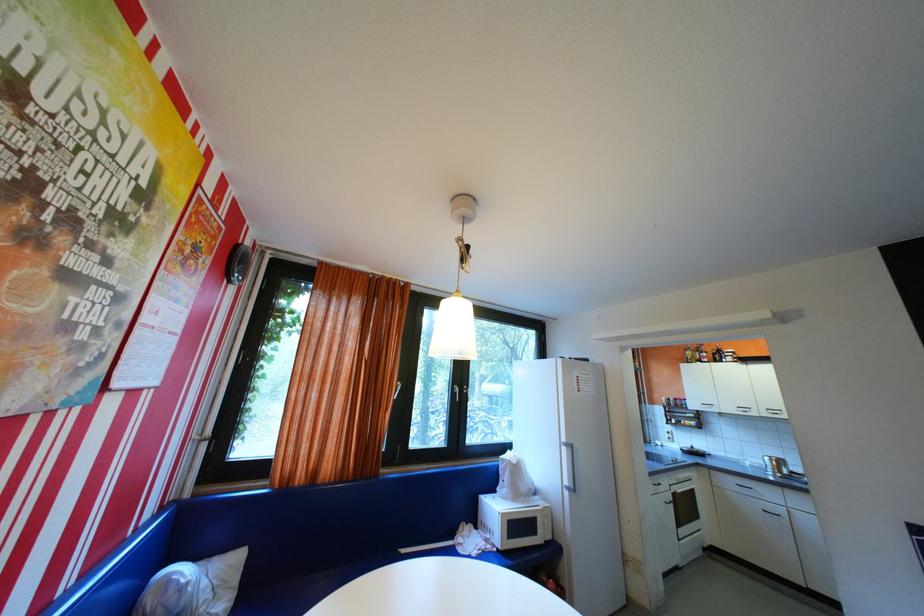
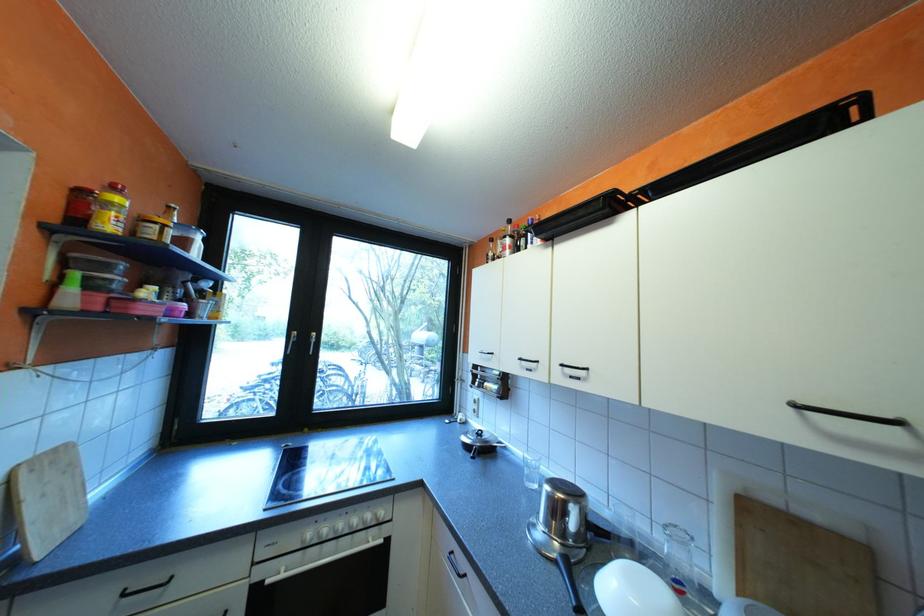
In the scene shown: What movement of the cameraman would produce the second image?

The movement direction of the cameraman is right, forward.